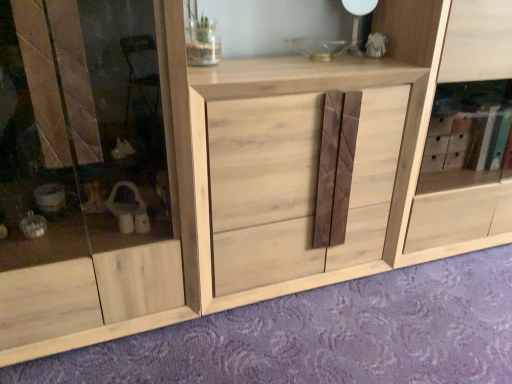
Question: From the image's perspective, is natural wood drawer at center on natural wood cabinet at center?

Choices:
 (A) no
 (B) yes

Answer: (A)

Question: From the image's perspective, is natural wood drawer at center below natural wood cabinet at center?

Choices:
 (A) no
 (B) yes

Answer: (B)

Question: From a real-world perspective, is natural wood drawer at center positioned over natural wood cabinet at center based on gravity?

Choices:
 (A) yes
 (B) no

Answer: (B)

Question: Could you tell me if natural wood drawer at center is facing natural wood cabinet at center?

Choices:
 (A) no
 (B) yes

Answer: (A)

Question: Can you confirm if natural wood drawer at center is thinner than natural wood cabinet at center?

Choices:
 (A) no
 (B) yes

Answer: (B)

Question: Considering their positions, is natural wood cabinet at center located in front of or behind natural wood drawer at center?

Choices:
 (A) front
 (B) behind

Answer: (B)

Question: Considering the relative positions of natural wood cabinet at center and natural wood drawer at center in the image provided, is natural wood cabinet at center to the left or to the right of natural wood drawer at center?

Choices:
 (A) right
 (B) left

Answer: (A)

Question: In terms of size, does natural wood cabinet at center appear bigger or smaller than natural wood drawer at center?

Choices:
 (A) big
 (B) small

Answer: (A)

Question: Which is correct: natural wood cabinet at center is inside natural wood drawer at center, or outside of it?

Choices:
 (A) outside
 (B) inside

Answer: (A)

Question: Looking at their shapes, would you say natural wood cabinet at center is wider or thinner than natural wood cabinet at center?

Choices:
 (A) wide
 (B) thin

Answer: (B)

Question: Considering the positions of natural wood cabinet at center and natural wood cabinet at center in the image, is natural wood cabinet at center bigger or smaller than natural wood cabinet at center?

Choices:
 (A) small
 (B) big

Answer: (B)

Question: Is natural wood cabinet at center in front of or behind natural wood cabinet at center in the image?

Choices:
 (A) behind
 (B) front

Answer: (A)

Question: Does point (413, 208) appear closer or farther from the camera than point (60, 61)?

Choices:
 (A) farther
 (B) closer

Answer: (A)

Question: Do you think natural wood cabinet at center is within natural wood cabinet at center, or outside of it?

Choices:
 (A) outside
 (B) inside

Answer: (A)

Question: Considering the positions of natural wood cabinet at center and natural wood cabinet at center in the image, is natural wood cabinet at center wider or thinner than natural wood cabinet at center?

Choices:
 (A) thin
 (B) wide

Answer: (B)